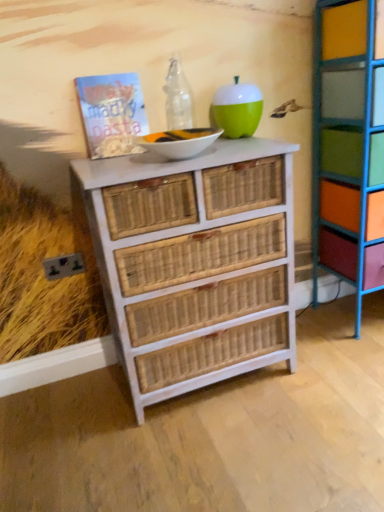
You are a GUI agent. You are given a task and a screenshot of the screen. Output one action in this format:
    pyautogui.click(x=<x>, y=<y>)
    Task: Click on the free spot to the right of white wicker chest of drawers at center
    
    Given the screenshot: What is the action you would take?
    pyautogui.click(x=327, y=376)